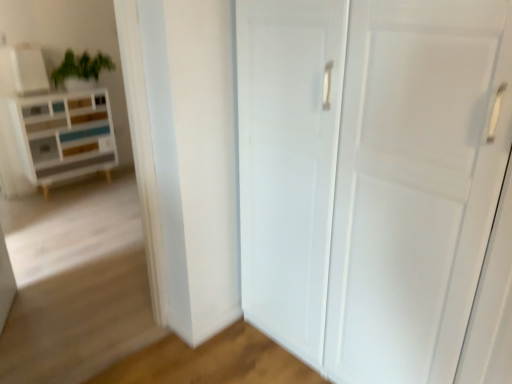
What are the coordinates of `vacant space underneath wooden/multicolored drawer at left (from a real-world perspective)` in the screenshot? It's located at (67, 187).